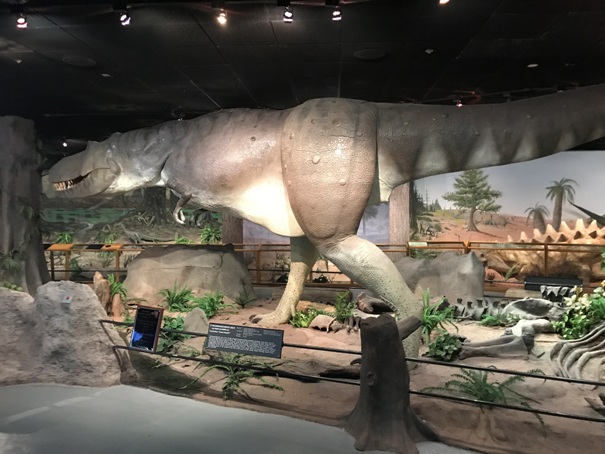
Locate an element on the screen. cement floor is located at coordinates (210, 432).